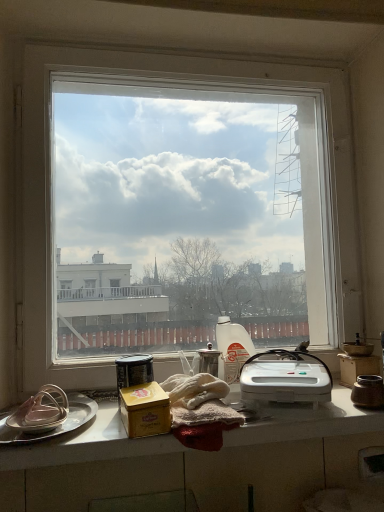
Identify the location of gold matte tin at center, the 3th appliance in the left-to-right sequence. (145, 410).

Locate an element on the screen. transparent glass window at center is located at coordinates (174, 205).

Image resolution: width=384 pixels, height=512 pixels. What do you see at coordinates (134, 370) in the screenshot?
I see `metallic canister at center, marked as the second appliance in a left-to-right arrangement` at bounding box center [134, 370].

Describe the element at coordinates (232, 348) in the screenshot. This screenshot has width=384, height=512. I see `white plastic bottle at center, the second appliance in the right-to-left sequence` at that location.

The image size is (384, 512). Find the location of `white plastic bottle at center, which is counted as the fifth appliance, starting from the left`. white plastic bottle at center, which is counted as the fifth appliance, starting from the left is located at coordinates (232, 348).

What do you see at coordinates (55, 428) in the screenshot?
I see `silver metallic platter at left` at bounding box center [55, 428].

You are a GUI agent. You are given a task and a screenshot of the screen. Output one action in this format:
    pyautogui.click(x=<x>, y=<y>)
    Task: Click on the white plastic sandwich maker at center
    The height and width of the screenshot is (512, 384).
    Given the screenshot: What is the action you would take?
    pyautogui.click(x=285, y=378)

Considering the sizes of objects gold matte tin at center, the 3th appliance in the left-to-right sequence, and transparent glass window at center in the image provided, who is bigger, gold matte tin at center, the 3th appliance in the left-to-right sequence, or transparent glass window at center?

With larger size is transparent glass window at center.

Considering the positions of objects gold matte tin at center, the 3th appliance in the left-to-right sequence, and transparent glass window at center in the image provided, who is behind, gold matte tin at center, the 3th appliance in the left-to-right sequence, or transparent glass window at center?

transparent glass window at center is further from the camera.

Is transparent glass window at center located within gold matte tin at center, the 3th appliance in the left-to-right sequence?

No, transparent glass window at center is located outside of gold matte tin at center, the 3th appliance in the left-to-right sequence.

Considering the positions of point (144, 416) and point (264, 202), is point (144, 416) closer or farther from the camera than point (264, 202)?

Point (144, 416) is positioned closer to the camera compared to point (264, 202).

Could silver metallic platter at left be considered to be inside white plastic bottle at center, the second appliance in the right-to-left sequence?

Actually, silver metallic platter at left is outside white plastic bottle at center, the second appliance in the right-to-left sequence.

From a real-world perspective, is white plastic bottle at center, the second appliance in the right-to-left sequence, beneath silver metallic platter at left?

No, from a real-world perspective, white plastic bottle at center, the second appliance in the right-to-left sequence, is not beneath silver metallic platter at left.

How different are the orientations of white plastic bottle at center, which is counted as the fifth appliance, starting from the left, and silver metallic platter at left in degrees?

3.2 degrees separate the facing orientations of white plastic bottle at center, which is counted as the fifth appliance, starting from the left, and silver metallic platter at left.

Which of these two, white plastic bottle at center, the second appliance in the right-to-left sequence, or silver metallic platter at left, is wider?

silver metallic platter at left is wider.

Is white plastic bottle at center, the second appliance in the right-to-left sequence, placed right next to gold matte tin at center, placed as the fourth appliance when sorted from right to left?

No, white plastic bottle at center, the second appliance in the right-to-left sequence, is not making contact with gold matte tin at center, placed as the fourth appliance when sorted from right to left.

From a real-world perspective, is white plastic bottle at center, the second appliance in the right-to-left sequence, above or below gold matte tin at center, the 3th appliance in the left-to-right sequence?

Clearly, from a real-world perspective, white plastic bottle at center, the second appliance in the right-to-left sequence, is above gold matte tin at center, the 3th appliance in the left-to-right sequence.

Is white plastic bottle at center, the second appliance in the right-to-left sequence, turned away from gold matte tin at center, the 3th appliance in the left-to-right sequence?

No, white plastic bottle at center, the second appliance in the right-to-left sequence, is not facing the opposite direction of gold matte tin at center, the 3th appliance in the left-to-right sequence.

From the image's perspective, is white plastic bottle at center, the second appliance in the right-to-left sequence, above or below gold matte tin at center, placed as the fourth appliance when sorted from right to left?

white plastic bottle at center, the second appliance in the right-to-left sequence, is situated higher than gold matte tin at center, placed as the fourth appliance when sorted from right to left, in the image.

Is gold matte tin at center, the 3th appliance in the left-to-right sequence, not close to silver metallic platter at left?

No.

From a real-world perspective, who is located lower, gold matte tin at center, placed as the fourth appliance when sorted from right to left, or silver metallic platter at left?

silver metallic platter at left, from a real-world perspective.

From the image's perspective, would you say gold matte tin at center, the 3th appliance in the left-to-right sequence, is positioned over silver metallic platter at left?

Indeed, from the image's perspective, gold matte tin at center, the 3th appliance in the left-to-right sequence, is shown above silver metallic platter at left.

Could you tell me if satin silver teapot at center, which appears as the 3th appliance when viewed from the right, is facing transparent glass window at center?

No, satin silver teapot at center, which appears as the 3th appliance when viewed from the right, does not turn towards transparent glass window at center.

Does satin silver teapot at center, which appears as the 3th appliance when viewed from the right, contain transparent glass window at center?

Actually, transparent glass window at center is outside satin silver teapot at center, which appears as the 3th appliance when viewed from the right.

Where is `window on the left of satin silver teapot at center, which is the fourth appliance in left-to-right order`? The width and height of the screenshot is (384, 512). window on the left of satin silver teapot at center, which is the fourth appliance in left-to-right order is located at coordinates (174, 205).

From a real-world perspective, which is physically above, satin silver teapot at center, which is the fourth appliance in left-to-right order, or transparent glass window at center?

transparent glass window at center is physically above.

From a real-world perspective, is matte silver lid at left, marked as the first appliance in a left-to-right arrangement, above or below silver metallic platter at left?

matte silver lid at left, marked as the first appliance in a left-to-right arrangement, is situated higher than silver metallic platter at left in the real world.

Considering the relative sizes of matte silver lid at left, the sixth appliance when ordered from right to left, and silver metallic platter at left in the image provided, is matte silver lid at left, the sixth appliance when ordered from right to left, smaller than silver metallic platter at left?

Actually, matte silver lid at left, the sixth appliance when ordered from right to left, might be larger than silver metallic platter at left.

How distant is matte silver lid at left, marked as the first appliance in a left-to-right arrangement, from silver metallic platter at left?

1.96 inches.

From a real-world perspective, between white glossy countertop at lower center and matte silver lid at left, marked as the first appliance in a left-to-right arrangement, who is vertically higher?

matte silver lid at left, marked as the first appliance in a left-to-right arrangement, from a real-world perspective.

Where is `countertop in front of the matte silver lid at left, marked as the first appliance in a left-to-right arrangement`? The width and height of the screenshot is (384, 512). countertop in front of the matte silver lid at left, marked as the first appliance in a left-to-right arrangement is located at coordinates (197, 461).

From the image's perspective, which one is positioned higher, white glossy countertop at lower center or matte silver lid at left, marked as the first appliance in a left-to-right arrangement?

matte silver lid at left, marked as the first appliance in a left-to-right arrangement, appears higher in the image.

The image size is (384, 512). I want to click on window that appears above the gold matte tin at center, the 3th appliance in the left-to-right sequence (from a real-world perspective), so click(174, 205).

The image size is (384, 512). Find the location of `platter that appears in front of the white plastic bottle at center, the second appliance in the right-to-left sequence`. platter that appears in front of the white plastic bottle at center, the second appliance in the right-to-left sequence is located at coordinates (55, 428).

Based on their spatial positions, is transparent glass window at center or satin silver teapot at center, which is the fourth appliance in left-to-right order, further from matte silver lid at left, marked as the first appliance in a left-to-right arrangement?

The object further to matte silver lid at left, marked as the first appliance in a left-to-right arrangement, is transparent glass window at center.

Which object lies further to the anchor point gold matte tin at center, the 3th appliance in the left-to-right sequence, brown ceramic jar at right, the 1th appliance from the right, or satin silver teapot at center, which appears as the 3th appliance when viewed from the right?

brown ceramic jar at right, the 1th appliance from the right, lies further to gold matte tin at center, the 3th appliance in the left-to-right sequence, than the other object.

Which object lies nearer to the anchor point white plastic bottle at center, which is counted as the fifth appliance, starting from the left, gold matte tin at center, placed as the fourth appliance when sorted from right to left, or white glossy countertop at lower center?

white glossy countertop at lower center.

From the image, which object appears to be farther from white plastic sandwich maker at center, satin silver teapot at center, which appears as the 3th appliance when viewed from the right, or silver metallic platter at left?

The object further to white plastic sandwich maker at center is silver metallic platter at left.

Looking at the image, which one is located closer to metallic canister at center, marked as the second appliance in a left-to-right arrangement, gold matte tin at center, the 3th appliance in the left-to-right sequence, or transparent glass window at center?

gold matte tin at center, the 3th appliance in the left-to-right sequence, lies closer to metallic canister at center, marked as the second appliance in a left-to-right arrangement, than the other object.

Estimate the real-world distances between objects in this image. Which object is further from transparent glass window at center, silver metallic platter at left or matte silver lid at left, the sixth appliance when ordered from right to left?

The object further to transparent glass window at center is matte silver lid at left, the sixth appliance when ordered from right to left.

Looking at the image, which one is located closer to silver metallic platter at left, satin silver teapot at center, which is the fourth appliance in left-to-right order, or white glossy countertop at lower center?

white glossy countertop at lower center lies closer to silver metallic platter at left than the other object.

From the image, which object appears to be nearer to gold matte tin at center, placed as the fourth appliance when sorted from right to left, matte silver lid at left, marked as the first appliance in a left-to-right arrangement, or brown ceramic jar at right, the 6th appliance positioned from the left?

matte silver lid at left, marked as the first appliance in a left-to-right arrangement, is positioned closer to the anchor gold matte tin at center, placed as the fourth appliance when sorted from right to left.

At what (x,y) coordinates should I click in order to perform the action: click on countertop between metallic canister at center, the fifth appliance viewed from the right, and white plastic sandwich maker at center, in the horizontal direction. Please return your answer as a coordinate pair (x, y). Image resolution: width=384 pixels, height=512 pixels. Looking at the image, I should click on (197, 461).

At what (x,y) coordinates should I click in order to perform the action: click on kitchen appliance between white glossy countertop at lower center and brown ceramic jar at right, the 1th appliance from the right, in the horizontal direction. Please return your answer as a coordinate pair (x, y). Image resolution: width=384 pixels, height=512 pixels. Looking at the image, I should click on (285, 378).

What are the coordinates of `kitchen appliance between metallic canister at center, the fifth appliance viewed from the right, and brown ceramic jar at right, the 6th appliance positioned from the left, from left to right` in the screenshot? It's located at click(285, 378).

Identify the location of countertop situated between silver metallic platter at left and brown ceramic jar at right, the 6th appliance positioned from the left, from left to right. The width and height of the screenshot is (384, 512). (197, 461).